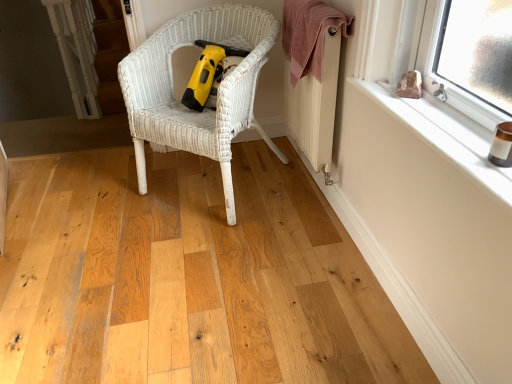
The height and width of the screenshot is (384, 512). I want to click on vacant space that is to the left of white wicker chair at center, so click(x=110, y=192).